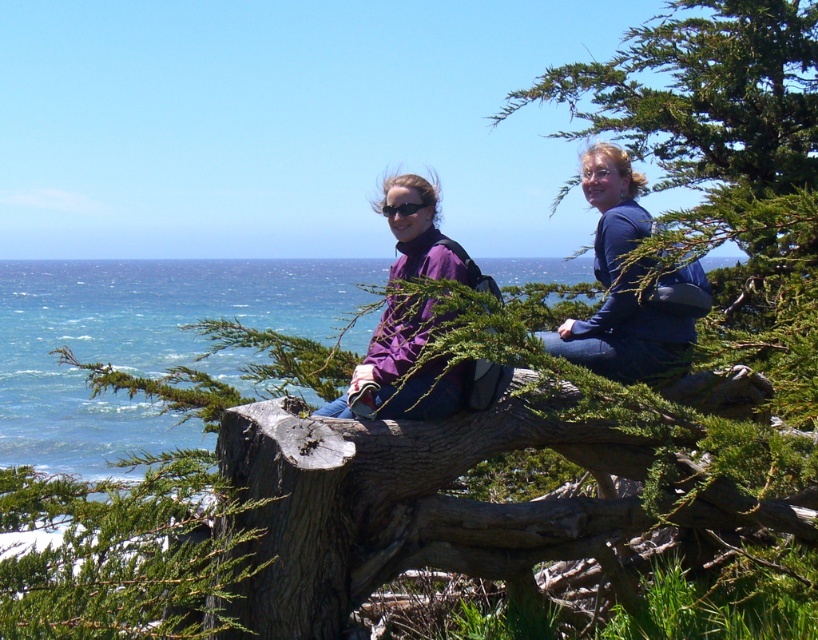
In the scene shown: You are trying to locate the purple matte jacket at center in the image. Based on the scene, where would you find it relative to the blue water at upper left?

The purple matte jacket at center is positioned to the right of the blue water at upper left.

You are an observer looking at the two individuals sitting on the tree branch. Both are wearing purple jackets. Which jacket, the purple fabric jacket at center or the purple matte jacket at center, appears taller when viewed from your perspective?

The purple fabric jacket at center appears taller than the purple matte jacket at center.

You are trying to locate the purple fabric jacket at center on the weathered tree branch. Based on the coordinates provided, is it closer to the edge of the branch or the trunk?

The purple fabric jacket at center is located at point (x=628, y=285). Since the coordinates are relative to the branch, with 0 being the trunk and 1 the edge, the jacket is closer to the edge of the branch as 0.769 is closer to 1 than 0.